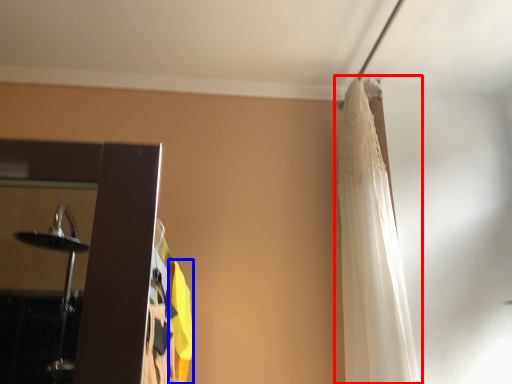
Question: Which object is closer to the camera taking this photo, curtain (highlighted by a red box) or curtain (highlighted by a blue box)?

Choices:
 (A) curtain
 (B) curtain

Answer: (B)